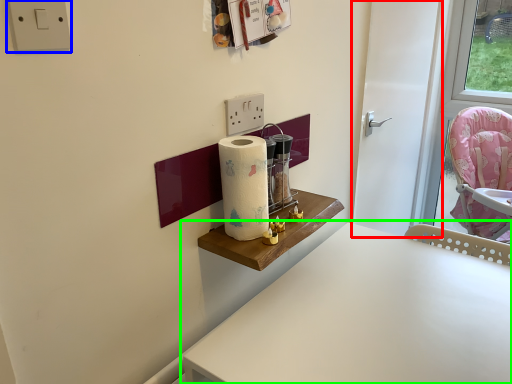
Question: Considering the real-world distances, which object is closest to door (highlighted by a red box)? electric outlet (highlighted by a blue box) or table (highlighted by a green box).

Choices:
 (A) electric outlet
 (B) table

Answer: (B)